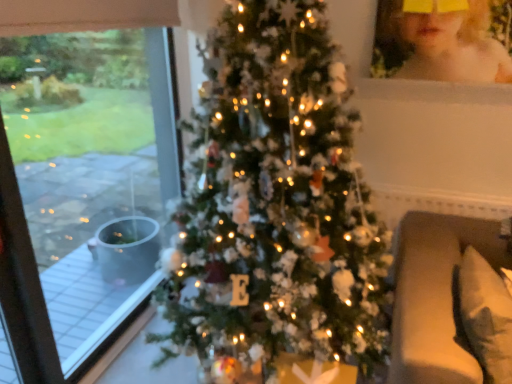
Where is `free spot below blonde hair at upper right (from a real-world perspective)`? The width and height of the screenshot is (512, 384). free spot below blonde hair at upper right (from a real-world perspective) is located at coordinates (437, 84).